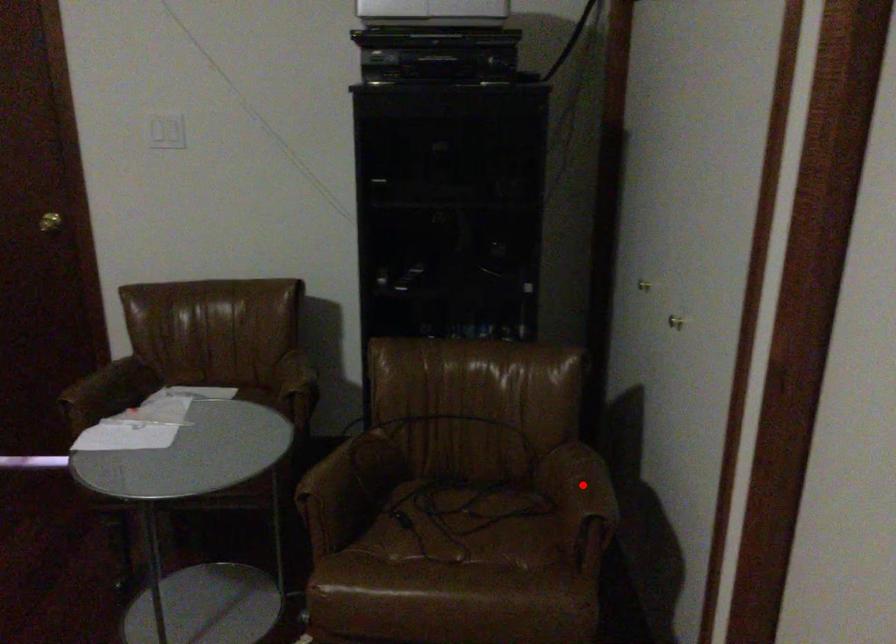
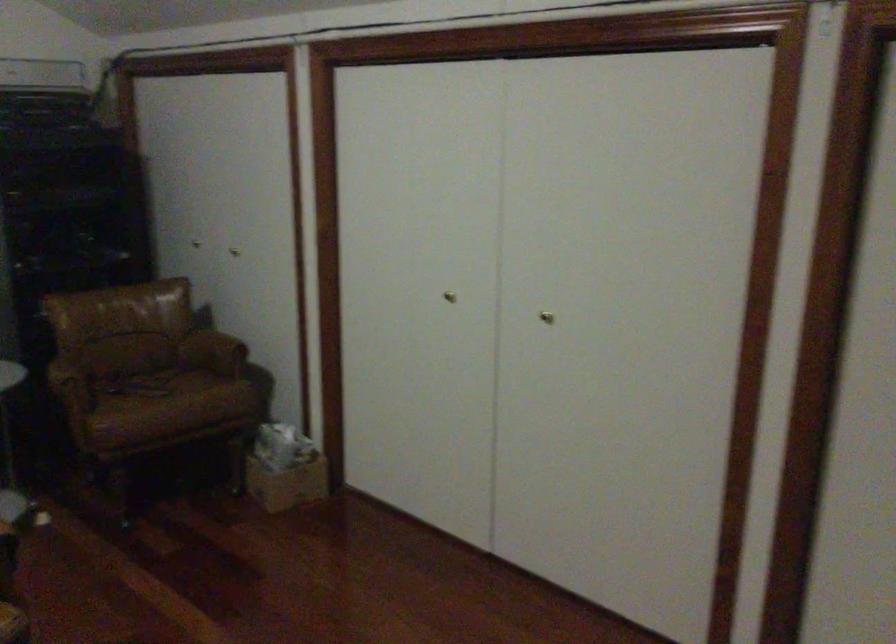
Question: I am providing you with two images of the same scene from different viewpoints. Given a red point in image1, look at the same physical point in image2. Is it:

Choices:
 (A) Closer to the viewpoint
 (B) Farther from the viewpoint

Answer: (B)